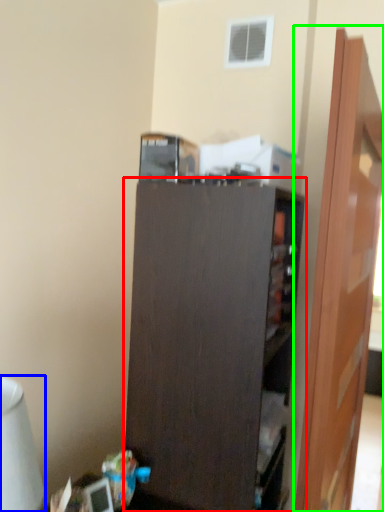
Question: Based on their relative distances, which object is farther from cupboard (highlighted by a red box)? Choose from table lamp (highlighted by a blue box) and door (highlighted by a green box).

Choices:
 (A) table lamp
 (B) door

Answer: (A)